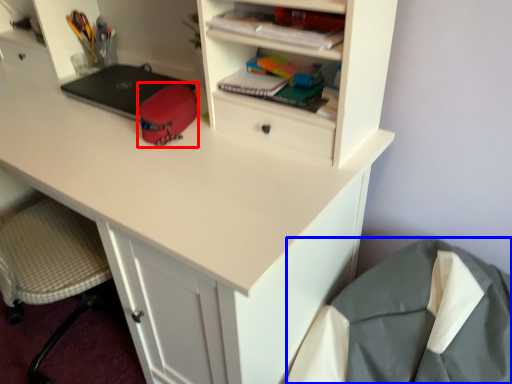
Question: Which object is further to the camera taking this photo, stationery (highlighted by a red box) or sleeping bag (highlighted by a blue box)?

Choices:
 (A) stationery
 (B) sleeping bag

Answer: (A)